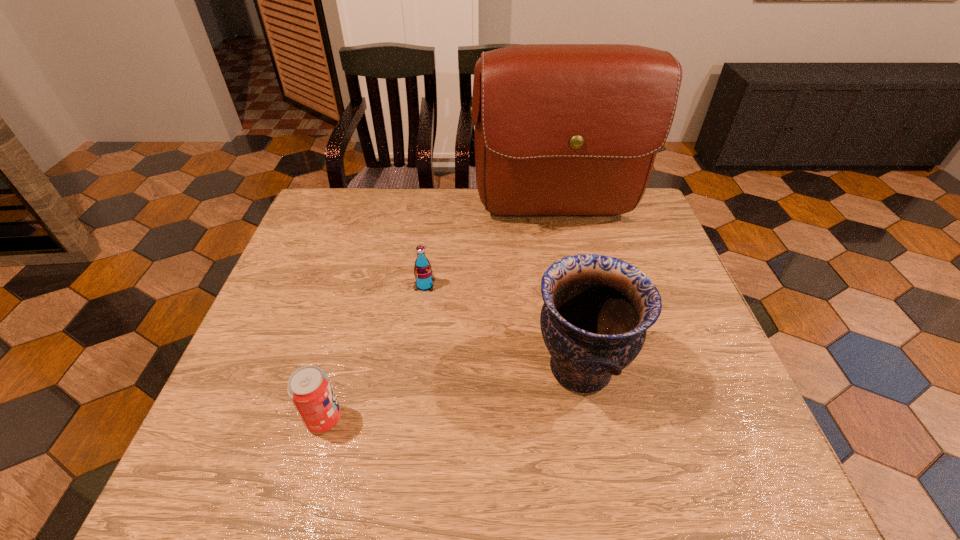
Identify the location of vacant region located 0.380m on the front handle of the pottery. (358, 368).

You are a GUI agent. You are given a task and a screenshot of the screen. Output one action in this format:
    pyautogui.click(x=<x>, y=<y>)
    Task: Click on the vacant position located on the back of the leftmost object
    The image size is (960, 540).
    Given the screenshot: What is the action you would take?
    click(x=357, y=297)

Find the location of a particular element. free space located on the back of the right soda is located at coordinates (435, 208).

You are a GUI agent. You are given a task and a screenshot of the screen. Output one action in this format:
    pyautogui.click(x=<x>, y=<y>)
    Task: Click on the object situated at the far edge
    Image resolution: width=960 pixels, height=540 pixels.
    Given the screenshot: What is the action you would take?
    pyautogui.click(x=561, y=130)

I want to click on object at the right edge, so click(x=561, y=130).

I want to click on object present at the far right corner, so click(561, 130).

Image resolution: width=960 pixels, height=540 pixels. I want to click on free space at the far edge, so click(x=381, y=231).

The width and height of the screenshot is (960, 540). Find the location of `vacant space at the near edge of the desktop`. vacant space at the near edge of the desktop is located at coordinates (359, 459).

You are a GUI agent. You are given a task and a screenshot of the screen. Output one action in this format:
    pyautogui.click(x=<x>, y=<y>)
    Task: Click on the free space at the left edge of the desktop
    
    Given the screenshot: What is the action you would take?
    pyautogui.click(x=236, y=381)

Where is `vacant space at the right edge of the desktop`? The height and width of the screenshot is (540, 960). vacant space at the right edge of the desktop is located at coordinates (620, 248).